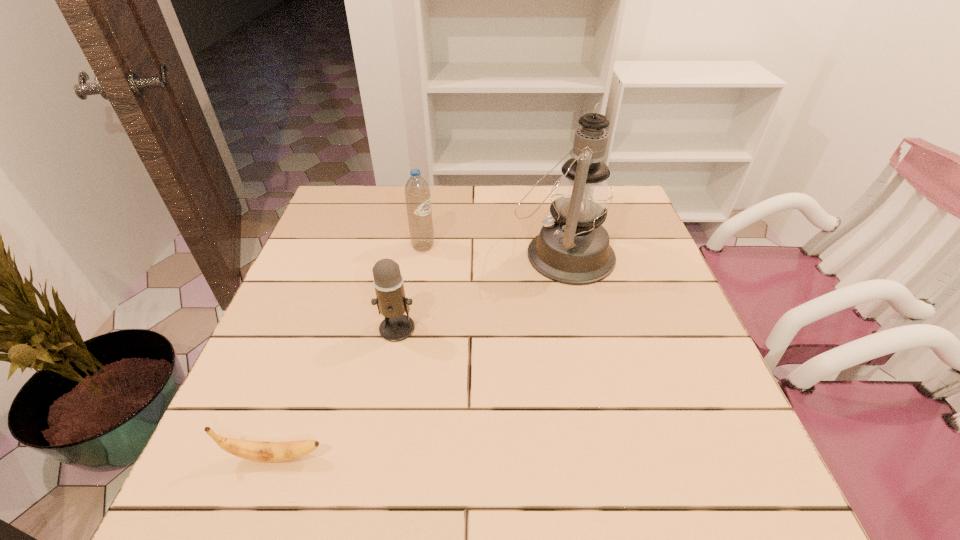
This screenshot has height=540, width=960. In order to click on the tallest object in this screenshot , I will do `click(573, 248)`.

The width and height of the screenshot is (960, 540). What are the coordinates of `oil lamp` in the screenshot? It's located at (573, 248).

Find the location of a particular element. The height and width of the screenshot is (540, 960). water bottle is located at coordinates (417, 192).

In order to click on microphone in this screenshot , I will do `click(390, 296)`.

Identify the location of the nearest object. The height and width of the screenshot is (540, 960). 261,451.

Locate an element on the screen. Image resolution: width=960 pixels, height=540 pixels. the shortest object is located at coordinates (261, 451).

Locate an element on the screen. The height and width of the screenshot is (540, 960). vacant space located on the left of the tallest object is located at coordinates (472, 254).

What are the coordinates of `free space located 0.120m on the right of the water bottle` in the screenshot? It's located at (477, 247).

Identify the location of free region located on the back of the second nearest object. Image resolution: width=960 pixels, height=540 pixels. (417, 226).

Image resolution: width=960 pixels, height=540 pixels. Find the location of `free space located on the peel of the shortest object from the top`. free space located on the peel of the shortest object from the top is located at coordinates (499, 457).